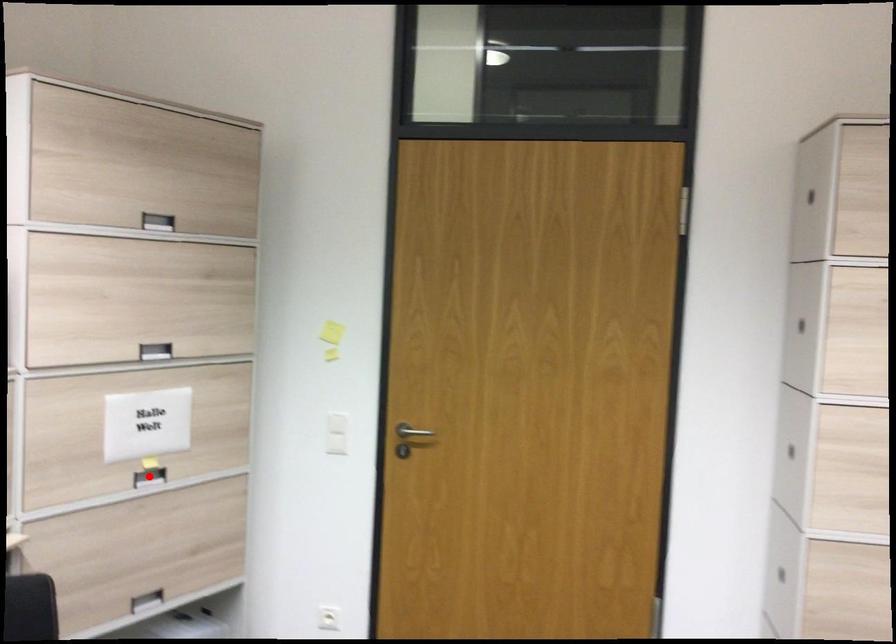
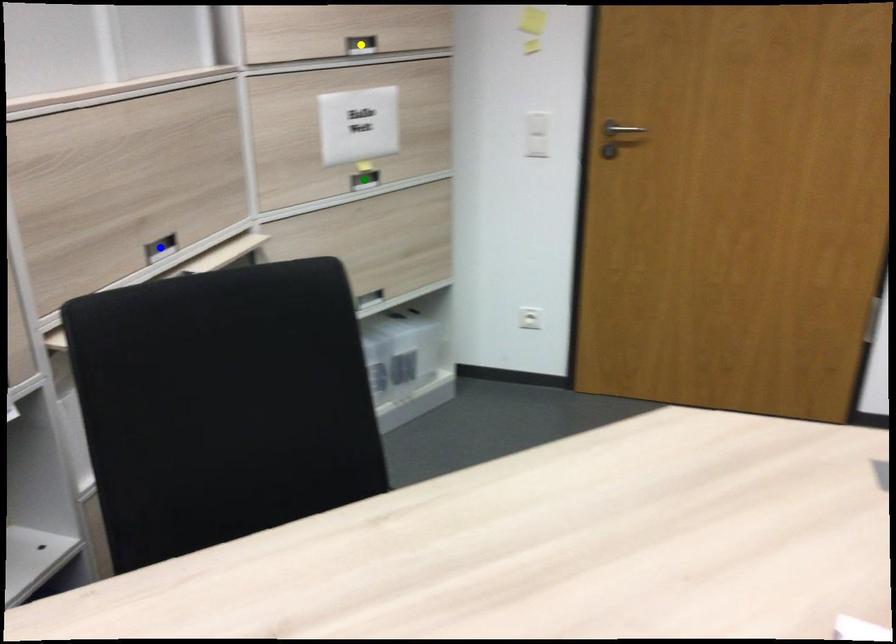
Question: I am providing you with two images of the same scene from different viewpoints. A red point is marked on the first image. You are given multiple points on the second image. Which spot in image 2 lines up with the point in image 1?

Choices:
 (A) green point
 (B) blue point
 (C) yellow point

Answer: (A)